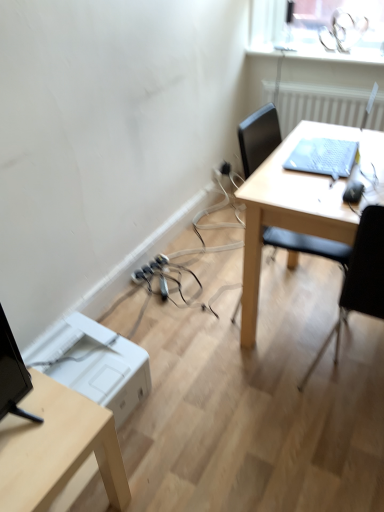
Where is `black plastic extension cord at lower center`? This screenshot has height=512, width=384. black plastic extension cord at lower center is located at coordinates (150, 268).

Image resolution: width=384 pixels, height=512 pixels. In order to click on black plastic chair at right in this screenshot , I will do `click(360, 279)`.

This screenshot has width=384, height=512. Identify the location of black plastic extension cord at lower center. 150,268.

Which is more distant, (135, 280) or (116, 390)?

The point (135, 280) is farther.

Is white plastic printer at lower left a part of black plastic extension cord at lower center?

No, black plastic extension cord at lower center does not contain white plastic printer at lower left.

Which object is further away from the camera, black plastic extension cord at lower center or white plastic printer at lower left?

black plastic extension cord at lower center is behind.

Measure the distance between black plastic extension cord at lower center and white plastic printer at lower left.

The distance of black plastic extension cord at lower center from white plastic printer at lower left is 26.77 inches.

You are a GUI agent. You are given a task and a screenshot of the screen. Output one action in this format:
    pyautogui.click(x=<x>, y=<y>)
    Task: Click on the table on the right of white textured radiator at upper right
    
    Given the screenshot: What is the action you would take?
    pyautogui.click(x=300, y=204)

Is white textured radiator at upper right not near light wood table at center?

That's not correct — white textured radiator at upper right is a little close to light wood table at center.

Is point (278, 101) positioned before point (335, 210)?

No.

Looking at their sizes, would you say white textured radiator at upper right is wider or thinner than light wood table at center?

Considering their sizes, white textured radiator at upper right looks slimmer than light wood table at center.

Identify the location of desk below the black plastic chair at right (from the image's perspective). (57, 448).

Considering the positions of points (368, 272) and (121, 479), is point (368, 272) farther from camera compared to point (121, 479)?

No, (368, 272) is closer to viewer.

Is black plastic chair at right to the right of light wood desk at lower left from the viewer's perspective?

Yes.

Is black plastic chair at right far away from light wood desk at lower left?

No, black plastic chair at right is not far away from light wood desk at lower left.

Can you confirm if white textured radiator at upper right is taller than black plastic extension cord at lower center?

Yes.

Looking at this image, in terms of width, does white textured radiator at upper right look wider or thinner when compared to black plastic extension cord at lower center?

Considering their sizes, white textured radiator at upper right looks broader than black plastic extension cord at lower center.

Would you say white textured radiator at upper right is to the left or to the right of black plastic extension cord at lower center in the picture?

Clearly, white textured radiator at upper right is on the right of black plastic extension cord at lower center in the image.

Considering the sizes of objects white textured radiator at upper right and black plastic chair at right in the image provided, who is thinner, white textured radiator at upper right or black plastic chair at right?

With smaller width is white textured radiator at upper right.

Choose the correct answer: Is white textured radiator at upper right inside black plastic chair at right or outside it?

white textured radiator at upper right cannot be found inside black plastic chair at right.

What's the angular difference between white textured radiator at upper right and black plastic chair at right's facing directions?

There is a 93.9-degree angle between the facing directions of white textured radiator at upper right and black plastic chair at right.

From the image's perspective, which one is positioned lower, white plastic printer at lower left or light wood desk at lower left?

light wood desk at lower left is shown below in the image.

From a real-world perspective, is white plastic printer at lower left located higher than light wood desk at lower left?

No, from a real-world perspective, white plastic printer at lower left is not above light wood desk at lower left.

In terms of size, does white plastic printer at lower left appear bigger or smaller than light wood desk at lower left?

Considering their sizes, white plastic printer at lower left takes up less space than light wood desk at lower left.

Would you say white plastic printer at lower left is outside light wood desk at lower left?

That's correct, white plastic printer at lower left is outside of light wood desk at lower left.

Is black plastic chair at right positioned far away from black plastic extension cord at lower center?

Absolutely, black plastic chair at right is distant from black plastic extension cord at lower center.

From the image's perspective, is black plastic chair at right above black plastic extension cord at lower center?

Yes, from the image's perspective, black plastic chair at right is on top of black plastic extension cord at lower center.

Locate an element on the screen. extension cord located behind the white plastic printer at lower left is located at coordinates (150, 268).

Identify the location of table that appears below the white textured radiator at upper right (from the image's perspective). The image size is (384, 512). (300, 204).

Looking at the image, which one is located further to black plastic extension cord at lower center, black plastic chair at right or light wood table at center?

black plastic chair at right is further to black plastic extension cord at lower center.

Considering their positions, is black plastic chair at right positioned further to light wood table at center than white textured radiator at upper right?

→ white textured radiator at upper right.

Based on their spatial positions, is light wood table at center or white textured radiator at upper right closer to black plastic extension cord at lower center?

The object closer to black plastic extension cord at lower center is light wood table at center.

When comparing their distances from black plastic extension cord at lower center, does light wood table at center or light wood desk at lower left seem further?

light wood desk at lower left.

From the image, which object appears to be farther from black plastic chair at right, light wood table at center or light wood desk at lower left?

light wood desk at lower left.

Estimate the real-world distances between objects in this image. Which object is further from black plastic chair at right, white plastic printer at lower left or light wood desk at lower left?

light wood desk at lower left.

Considering their positions, is white plastic printer at lower left positioned closer to black plastic extension cord at lower center than black plastic chair at right?

white plastic printer at lower left is closer to black plastic extension cord at lower center.

Looking at this image, estimate the real-world distances between objects in this image. Which object is further from black plastic chair at right, black plastic extension cord at lower center or white textured radiator at upper right?

white textured radiator at upper right is positioned further to the anchor black plastic chair at right.

The width and height of the screenshot is (384, 512). In order to click on table located between black plastic chair at right and black plastic extension cord at lower center in the depth direction in this screenshot , I will do `click(300, 204)`.

I want to click on printer between white textured radiator at upper right and black plastic extension cord at lower center in the front-back direction, so click(x=103, y=367).

Locate an element on the screen. The width and height of the screenshot is (384, 512). printer between light wood desk at lower left and light wood table at center from left to right is located at coordinates (103, 367).

Locate an element on the screen. This screenshot has height=512, width=384. radiator located between light wood table at center and black plastic extension cord at lower center in the depth direction is located at coordinates (320, 105).